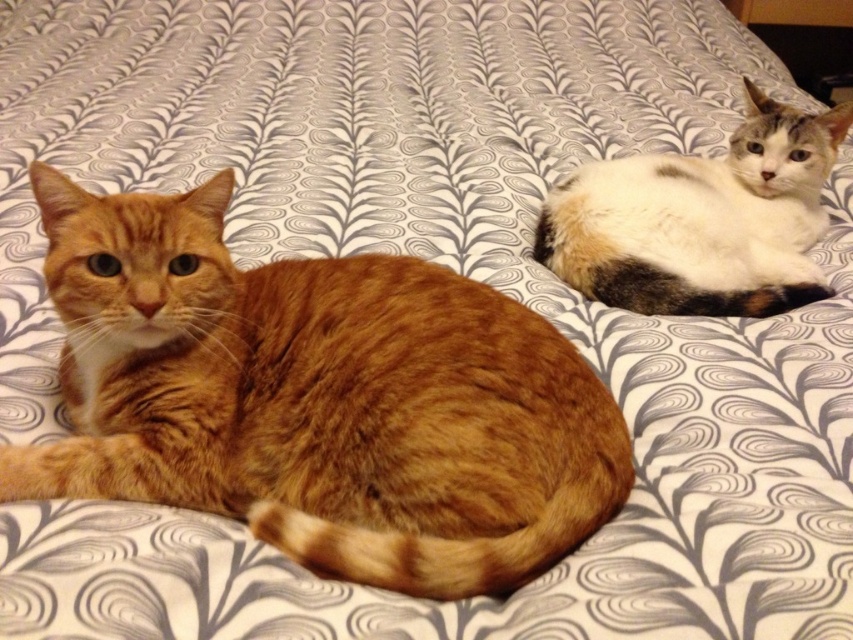
Between orange fur cat at left and calico fur cat at upper right, which one has less height?

orange fur cat at left is shorter.

Does orange fur cat at left have a lesser width compared to calico fur cat at upper right?

No.

Does point (206, 497) lie behind point (599, 292)?

That is False.

Locate an element on the screen. orange fur cat at left is located at coordinates (317, 397).